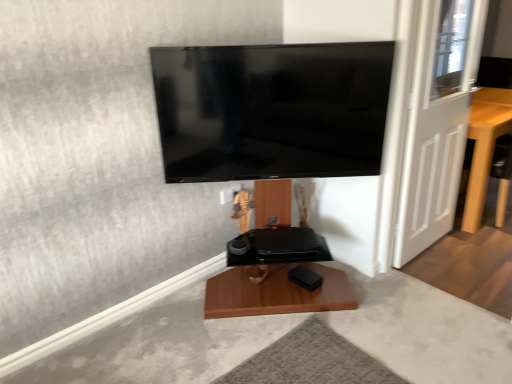
Identify the location of light brown wooden table at right. (484, 147).

This screenshot has height=384, width=512. I want to click on white wooden door at right, so click(437, 122).

Locate an element on the screen. Image resolution: width=512 pixels, height=384 pixels. light brown wooden table at right is located at coordinates (484, 147).

Locate an element on the screen. This screenshot has height=384, width=512. door located on the left of light brown wooden table at right is located at coordinates (437, 122).

From the image's perspective, which one is positioned lower, light brown wooden table at right or white wooden door at right?

light brown wooden table at right, from the image's perspective.

Is white wooden door at right at the back of light brown wooden table at right?

No, light brown wooden table at right is not facing away from white wooden door at right.

Is light brown wooden table at right next to flat screen tv at upper center?

light brown wooden table at right and flat screen tv at upper center are not in contact.

Is light brown wooden table at right taller or shorter than flat screen tv at upper center?

light brown wooden table at right is taller than flat screen tv at upper center.

Where is `television to the left of light brown wooden table at right`? television to the left of light brown wooden table at right is located at coordinates (272, 110).

Would you say light brown wooden table at right contains flat screen tv at upper center?

Definitely not — flat screen tv at upper center is not inside light brown wooden table at right.

Is flat screen tv at upper center spatially inside light brown wooden table at right, or outside of it?

flat screen tv at upper center is located beyond the bounds of light brown wooden table at right.

From the picture: Who is smaller, flat screen tv at upper center or light brown wooden table at right?

With smaller size is flat screen tv at upper center.

Locate an element on the screen. This screenshot has width=512, height=384. television above the light brown wooden table at right (from the image's perspective) is located at coordinates click(x=272, y=110).

Does flat screen tv at upper center turn towards light brown wooden table at right?

No, flat screen tv at upper center is not oriented towards light brown wooden table at right.

Which of these two, white wooden door at right or flat screen tv at upper center, stands shorter?

flat screen tv at upper center.

Which of these two, white wooden door at right or flat screen tv at upper center, is bigger?

With larger size is white wooden door at right.

Is point (446, 91) closer to camera compared to point (218, 87)?

No, (446, 91) is behind (218, 87).

In the scene shown: Does white wooden door at right come in front of light brown wooden table at right?

Yes, white wooden door at right is in front of light brown wooden table at right.

What are the coordinates of `door in front of the light brown wooden table at right` in the screenshot? It's located at (437, 122).

Is white wooden door at right to the right of light brown wooden table at right from the viewer's perspective?

In fact, white wooden door at right is to the left of light brown wooden table at right.

Considering the relative sizes of white wooden door at right and light brown wooden table at right in the image provided, is white wooden door at right thinner than light brown wooden table at right?

Indeed, white wooden door at right has a lesser width compared to light brown wooden table at right.

From a real-world perspective, is flat screen tv at upper center physically below white wooden door at right?

No, from a real-world perspective, flat screen tv at upper center is not under white wooden door at right.

Is flat screen tv at upper center facing towards white wooden door at right?

No, flat screen tv at upper center does not turn towards white wooden door at right.

Is flat screen tv at upper center positioned far away from white wooden door at right?

No, flat screen tv at upper center is not far away from white wooden door at right.

Who is taller, flat screen tv at upper center or white wooden door at right?

With more height is white wooden door at right.

In the image, there is a white wooden door at right. At what (x,y) coordinates should I click in order to perform the action: click on furniture below it (from a real-world perspective). Please return your answer as a coordinate pair (x, y). This screenshot has width=512, height=384. Looking at the image, I should click on (484, 147).

Find the location of a particular element. This screenshot has height=384, width=512. television located on the left of light brown wooden table at right is located at coordinates (272, 110).

Looking at the image, which one is located further to flat screen tv at upper center, light brown wooden table at right or white wooden door at right?

Based on the image, light brown wooden table at right appears to be further to flat screen tv at upper center.

Estimate the real-world distances between objects in this image. Which object is closer to light brown wooden table at right, white wooden door at right or flat screen tv at upper center?

The object closer to light brown wooden table at right is white wooden door at right.

Looking at the image, which one is located further to white wooden door at right, light brown wooden table at right or flat screen tv at upper center?

flat screen tv at upper center.

Based on their spatial positions, is flat screen tv at upper center or light brown wooden table at right further from white wooden door at right?

flat screen tv at upper center is positioned further to the anchor white wooden door at right.

Based on their spatial positions, is white wooden door at right or light brown wooden table at right further from flat screen tv at upper center?

light brown wooden table at right.

Looking at this image, from the image, which object appears to be nearer to light brown wooden table at right, flat screen tv at upper center or white wooden door at right?

white wooden door at right is closer to light brown wooden table at right.

The height and width of the screenshot is (384, 512). What are the coordinates of `door between flat screen tv at upper center and light brown wooden table at right` in the screenshot? It's located at (437, 122).